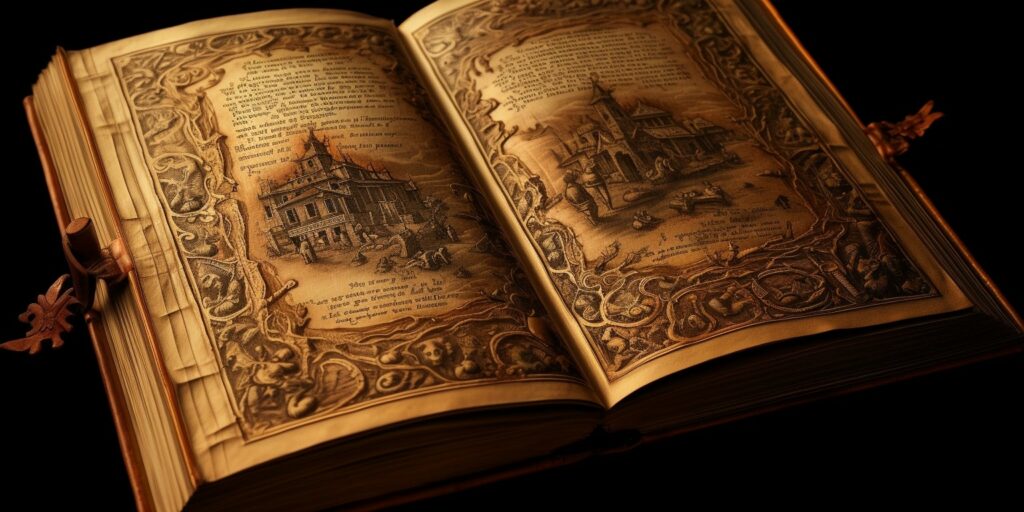
Where is `book`? book is located at coordinates 366,270.